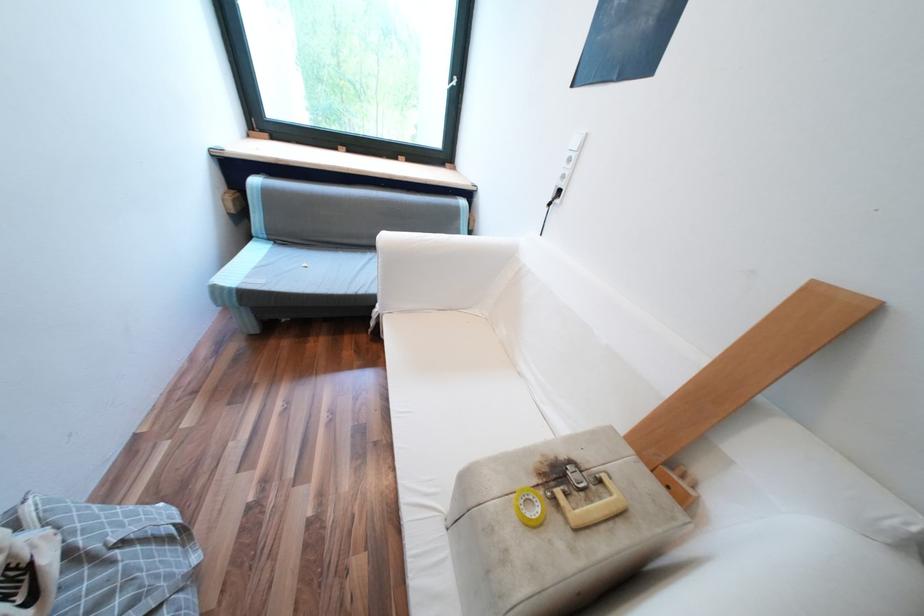
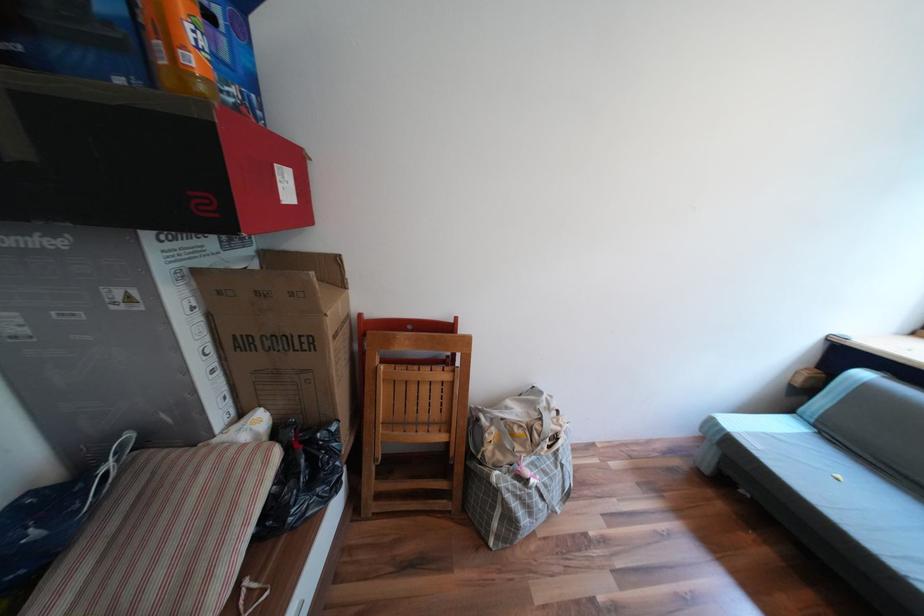
Question: The first image is from the beginning of the video and the second image is from the end. How did the camera likely rotate when shooting the video?

Choices:
 (A) Left
 (B) Right
 (C) Up
 (D) Down

Answer: (A)